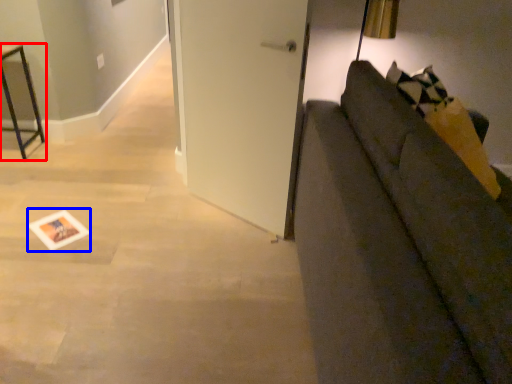
Question: Which object appears closest to the camera in this image, furniture (highlighted by a red box) or postcard (highlighted by a blue box)?

Choices:
 (A) furniture
 (B) postcard

Answer: (B)